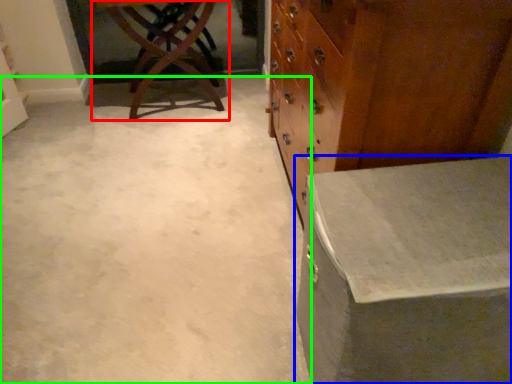
Question: Which object is positioned closest to table (highlighted by a red box)? Select from table (highlighted by a blue box) and concrete (highlighted by a green box).

Choices:
 (A) table
 (B) concrete

Answer: (B)